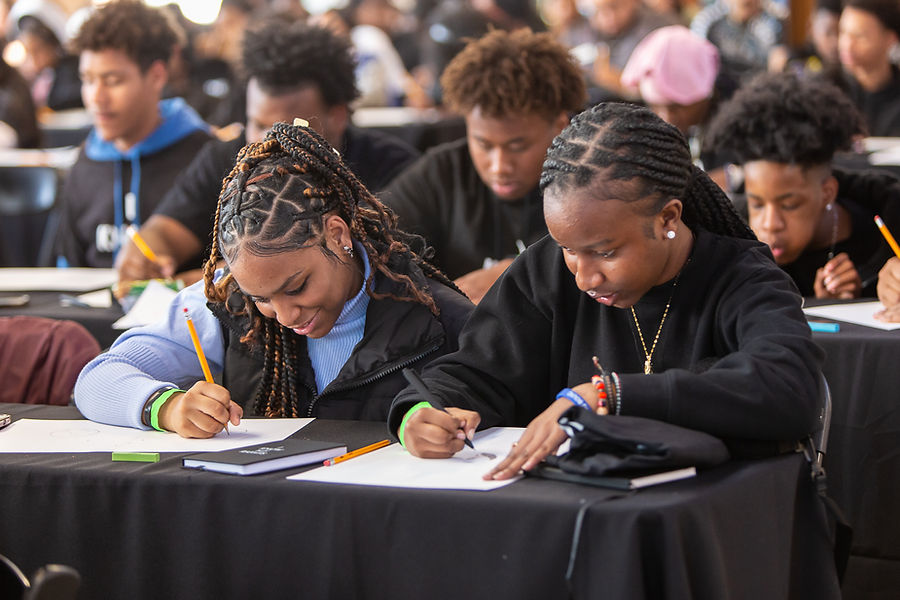
The width and height of the screenshot is (900, 600). What are the coordinates of `second row table` in the screenshot? It's located at (841, 362).